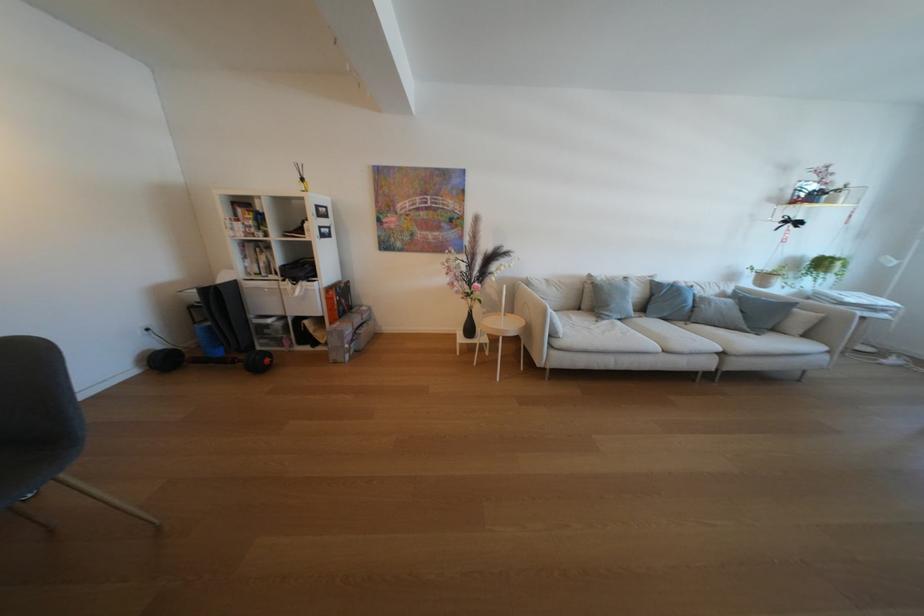
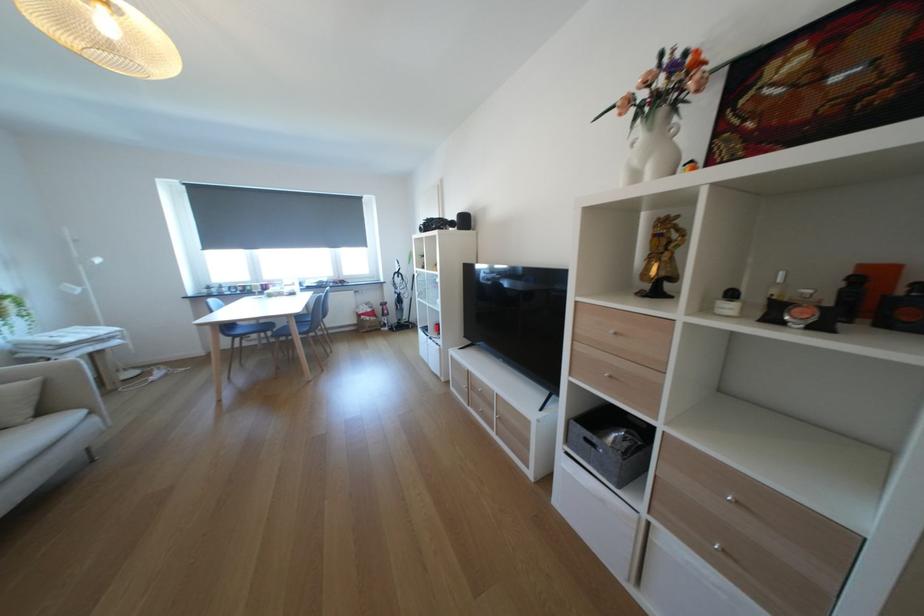
The images are taken continuously from a first-person perspective. In which direction is your viewpoint rotating?

The rotation direction of the camera is right-down.